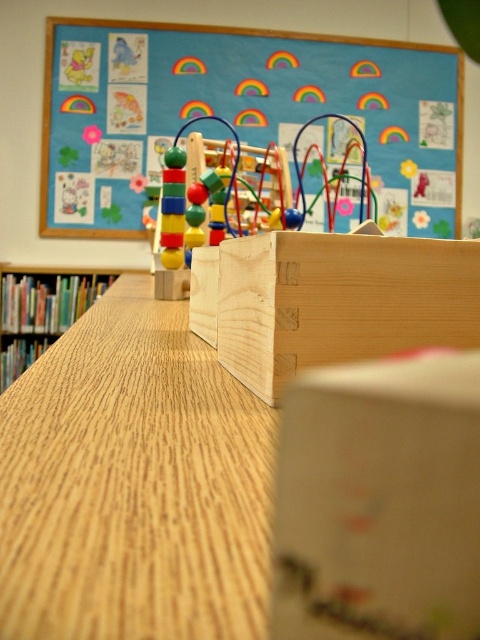
You are a teacher trying to organize the classroom. You have a matte wooden board at upper center and multicolored wooden beads at center. If you want to place a new educational poster between them, will there be enough space?

The distance between the matte wooden board at upper center and the multicolored wooden beads at center is 6.40 feet, so there is sufficient space to place a new educational poster between them.

In the scene shown: Based on the scene description, where is the matte wooden board at upper center located in the image?

The matte wooden board at upper center is located at point coordinates of 0.173 on the x axis and 0.492 on the y axis.

You are a teacher organizing the classroom. You need to place a new poster on the matte wooden board at upper center. Where exactly should you place it according to the coordinates provided?

The matte wooden board at upper center should be placed at the coordinates point (236, 109) as specified.